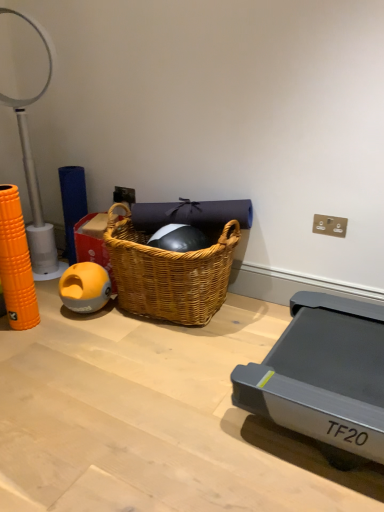
The image size is (384, 512). Find the location of `free point to the left of woven wood picnic basket at center`. free point to the left of woven wood picnic basket at center is located at coordinates (63, 331).